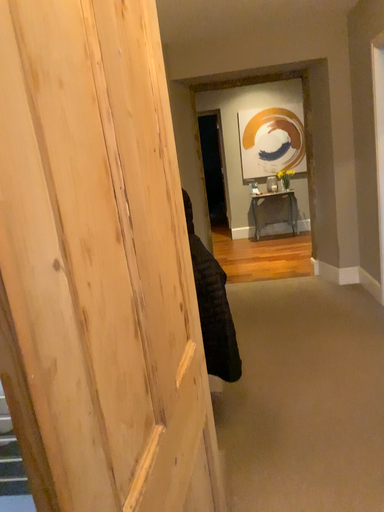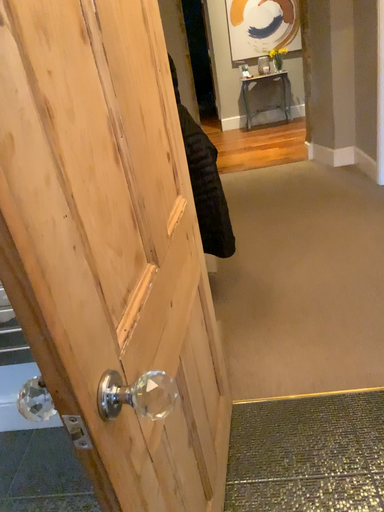
Question: How did the camera likely rotate when shooting the video?

Choices:
 (A) rotated upward
 (B) rotated downward

Answer: (B)